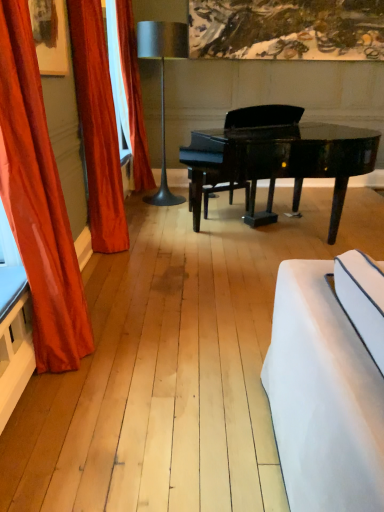
Question: Considering the relative sizes of orange velvet curtain at left, the first curtain when ordered from back to front, and velvet orange curtain at left, which ranks as the 2th curtain in front-to-back order, in the image provided, is orange velvet curtain at left, the first curtain when ordered from back to front, wider than velvet orange curtain at left, which ranks as the 2th curtain in front-to-back order,?

Choices:
 (A) yes
 (B) no

Answer: (A)

Question: Is orange velvet curtain at left, the 3th curtain in the front-to-back sequence, thinner than velvet orange curtain at left, which ranks as the 2th curtain in front-to-back order?

Choices:
 (A) no
 (B) yes

Answer: (A)

Question: Does orange velvet curtain at left, the first curtain when ordered from back to front, touch velvet orange curtain at left, the second curtain when ordered from back to front?

Choices:
 (A) no
 (B) yes

Answer: (A)

Question: Is orange velvet curtain at left, the first curtain when ordered from back to front, oriented away from velvet orange curtain at left, which ranks as the 2th curtain in front-to-back order?

Choices:
 (A) yes
 (B) no

Answer: (B)

Question: Can you confirm if orange velvet curtain at left, the 3th curtain in the front-to-back sequence, is bigger than velvet orange curtain at left, which ranks as the 2th curtain in front-to-back order?

Choices:
 (A) no
 (B) yes

Answer: (B)

Question: Is orange velvet curtain at left, the 3th curtain in the front-to-back sequence, not inside velvet orange curtain at left, the second curtain when ordered from back to front?

Choices:
 (A) no
 (B) yes

Answer: (B)

Question: Can you confirm if satin orange curtain at left, which is the third curtain in back-to-front order, is wider than glossy black piano at center?

Choices:
 (A) yes
 (B) no

Answer: (B)

Question: From a real-world perspective, is satin orange curtain at left, which is the third curtain in back-to-front order, over glossy black piano at center?

Choices:
 (A) no
 (B) yes

Answer: (B)

Question: Is satin orange curtain at left, which is the third curtain in back-to-front order, turned away from glossy black piano at center?

Choices:
 (A) no
 (B) yes

Answer: (A)

Question: Can you confirm if satin orange curtain at left, the 1th curtain positioned from the front, is taller than glossy black piano at center?

Choices:
 (A) no
 (B) yes

Answer: (B)

Question: Does satin orange curtain at left, the 1th curtain positioned from the front, have a smaller size compared to glossy black piano at center?

Choices:
 (A) no
 (B) yes

Answer: (B)

Question: Is satin orange curtain at left, which is the third curtain in back-to-front order, next to metallic gray floor lamp at center?

Choices:
 (A) no
 (B) yes

Answer: (A)